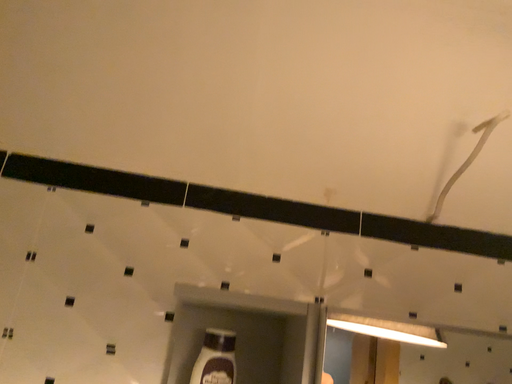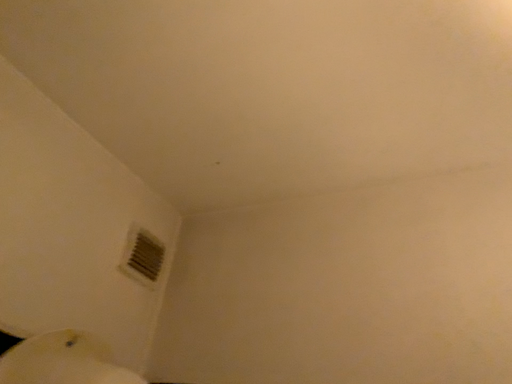
Question: Which way did the camera rotate in the video?

Choices:
 (A) rotated upward
 (B) rotated downward

Answer: (A)